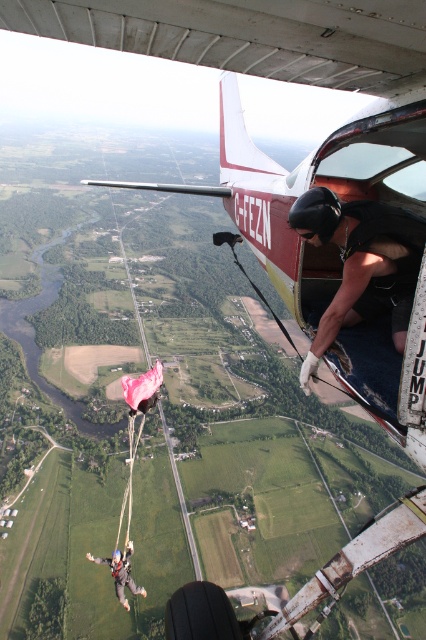
Question: Among these points, which one is nearest to the camera?

Choices:
 (A) (120, 595)
 (B) (412, 272)

Answer: (B)

Question: Does black matte helmet at upper center appear on the right side of gray fabric parachute at lower left?

Choices:
 (A) yes
 (B) no

Answer: (A)

Question: Can you confirm if black matte helmet at upper center is bigger than gray fabric parachute at lower left?

Choices:
 (A) yes
 (B) no

Answer: (B)

Question: Can you confirm if black matte helmet at upper center is positioned above gray fabric parachute at lower left?

Choices:
 (A) no
 (B) yes

Answer: (B)

Question: Which point is farther to the camera?

Choices:
 (A) (126, 582)
 (B) (325, 237)

Answer: (A)

Question: Among these points, which one is nearest to the camera?

Choices:
 (A) (301, 216)
 (B) (126, 582)

Answer: (A)